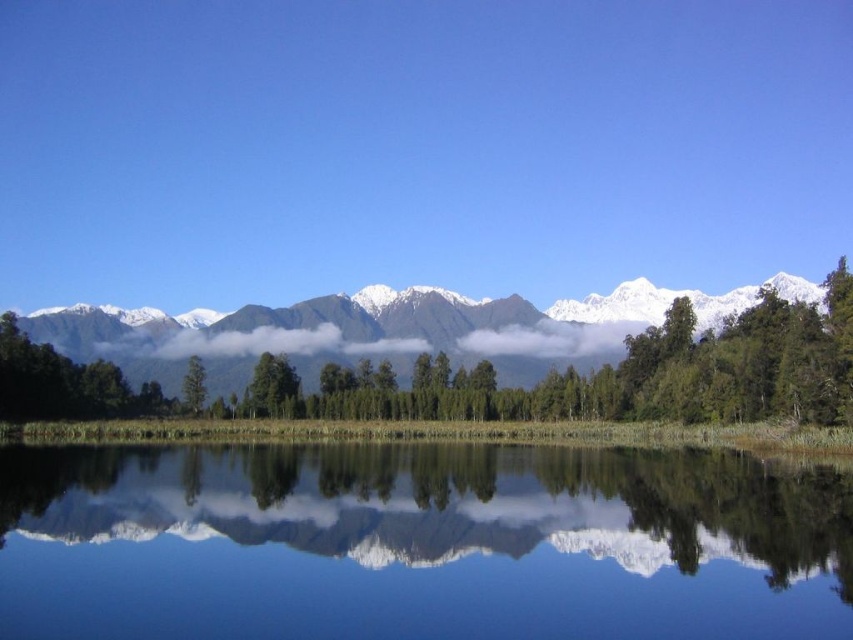
Which is more to the left, snowy mountain range at center or green matte tree at center?

From the viewer's perspective, green matte tree at center appears more on the left side.

Which is below, snowy mountain range at center or green matte tree at center?

green matte tree at center is lower down.

Measure the distance between snowy mountain range at center and camera.

snowy mountain range at center is 468.05 feet away from camera.

Where is `snowy mountain range at center`? snowy mountain range at center is located at coordinates (387, 330).

Is point (247, 337) in front of point (183, 397)?

No.

Who is lower down, white fluffy cloud at center or green matte tree at center?

green matte tree at center is lower down.

At what (x,y) coordinates should I click in order to perform the action: click on white fluffy cloud at center. Please return your answer as a coordinate pair (x, y). Looking at the image, I should click on (252, 342).

Identify the location of white fluffy cloud at center. The width and height of the screenshot is (853, 640). (252, 342).

Does snowy mountain range at center have a lesser height compared to white fluffy cloud at center?

In fact, snowy mountain range at center may be taller than white fluffy cloud at center.

The width and height of the screenshot is (853, 640). What do you see at coordinates (387, 330) in the screenshot? I see `snowy mountain range at center` at bounding box center [387, 330].

Between point (158, 328) and point (250, 337), which one is positioned behind?

The point (158, 328) is more distant.

Find the location of `snowy mountain range at center`. snowy mountain range at center is located at coordinates (387, 330).